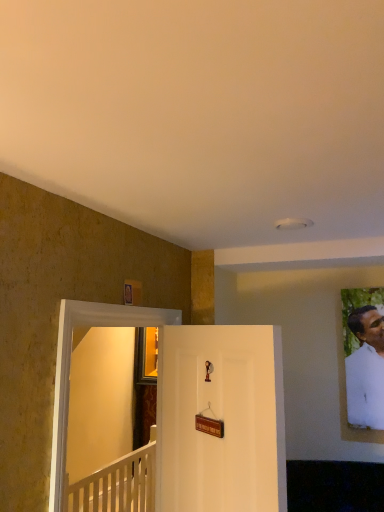
Question: Is transparent glass door at left oriented towards white wooden railing at lower left?

Choices:
 (A) no
 (B) yes

Answer: (A)

Question: Is transparent glass door at left positioned before white wooden railing at lower left?

Choices:
 (A) yes
 (B) no

Answer: (A)

Question: From the image's perspective, is transparent glass door at left under white wooden railing at lower left?

Choices:
 (A) no
 (B) yes

Answer: (A)

Question: Is transparent glass door at left wider than white wooden railing at lower left?

Choices:
 (A) no
 (B) yes

Answer: (A)

Question: From a real-world perspective, does transparent glass door at left stand above white wooden railing at lower left?

Choices:
 (A) yes
 (B) no

Answer: (A)

Question: From the image's perspective, is transparent glass door at left on top of white wooden railing at lower left?

Choices:
 (A) no
 (B) yes

Answer: (B)

Question: Is white matte portrait at right positioned behind white matte door at center?

Choices:
 (A) no
 (B) yes

Answer: (B)

Question: From the image's perspective, is white matte portrait at right over white matte door at center?

Choices:
 (A) yes
 (B) no

Answer: (A)

Question: Can you confirm if white matte portrait at right is bigger than white matte door at center?

Choices:
 (A) no
 (B) yes

Answer: (A)

Question: Could white matte door at center be considered to be inside white matte portrait at right?

Choices:
 (A) no
 (B) yes

Answer: (A)

Question: From a real-world perspective, is white matte portrait at right below white matte door at center?

Choices:
 (A) yes
 (B) no

Answer: (B)

Question: Does white matte portrait at right have a smaller size compared to white matte door at center?

Choices:
 (A) yes
 (B) no

Answer: (A)

Question: Considering the relative sizes of transparent glass door at left and white matte door at center in the image provided, is transparent glass door at left bigger than white matte door at center?

Choices:
 (A) yes
 (B) no

Answer: (B)